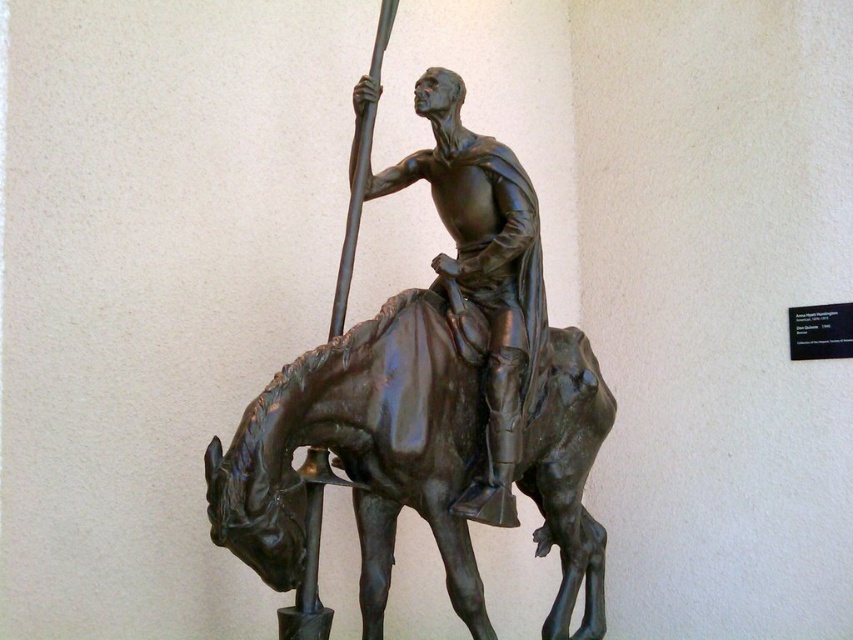
Question: Does shiny bronze horse at center come behind bronze statue at center?

Choices:
 (A) no
 (B) yes

Answer: (A)

Question: Which point is farther to the camera?

Choices:
 (A) (239, 480)
 (B) (486, 349)

Answer: (B)

Question: Does shiny bronze horse at center have a lesser width compared to bronze statue at center?

Choices:
 (A) yes
 (B) no

Answer: (B)

Question: Is shiny bronze horse at center to the right of bronze statue at center from the viewer's perspective?

Choices:
 (A) yes
 (B) no

Answer: (B)